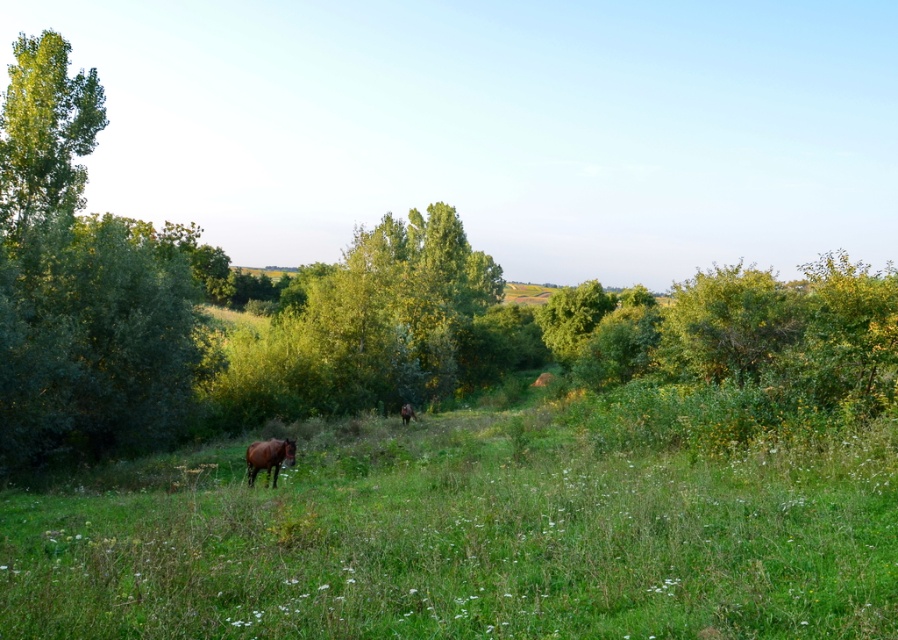
Question: Is green leafy tree at left wider than brown glossy horse at lower left?

Choices:
 (A) yes
 (B) no

Answer: (A)

Question: Which of the following is the farthest from the observer?

Choices:
 (A) green grass at lower center
 (B) brown glossy horse at lower left

Answer: (B)

Question: Which object is the closest to the brown glossy horse at center?

Choices:
 (A) green leafy tree at left
 (B) green leafy tree at upper left

Answer: (B)

Question: Can you confirm if green leafy tree at upper left is positioned to the right of brown glossy horse at center?

Choices:
 (A) yes
 (B) no

Answer: (B)

Question: Estimate the real-world distances between objects in this image. Which object is farther from the green leafy tree at upper left?

Choices:
 (A) brown glossy horse at center
 (B) green leafy tree at left
 (C) green grass at lower center

Answer: (C)

Question: Is green leafy tree at upper left thinner than brown glossy horse at center?

Choices:
 (A) no
 (B) yes

Answer: (A)